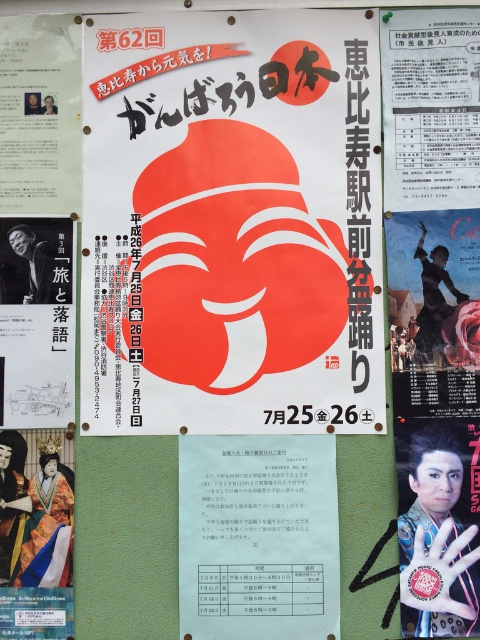
Is the position of matte red mask at center more distant than that of white paper at center?

Yes.

Who is more distant from viewer, (313, 355) or (232, 579)?

The point (313, 355) is more distant.

Where is `matte red mask at center`? The image size is (480, 640). matte red mask at center is located at coordinates (231, 224).